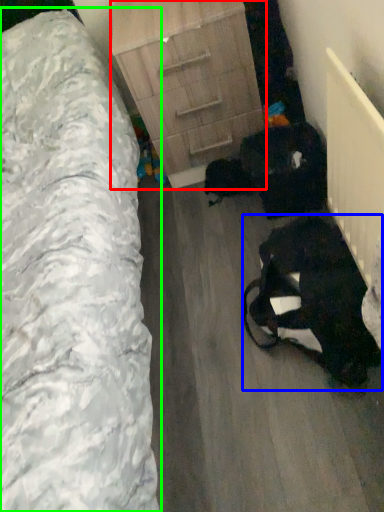
Question: Considering the real-world distances, which object is closest to chest of drawers (highlighted by a red box)? animal (highlighted by a blue box) or furniture (highlighted by a green box).

Choices:
 (A) animal
 (B) furniture

Answer: (B)